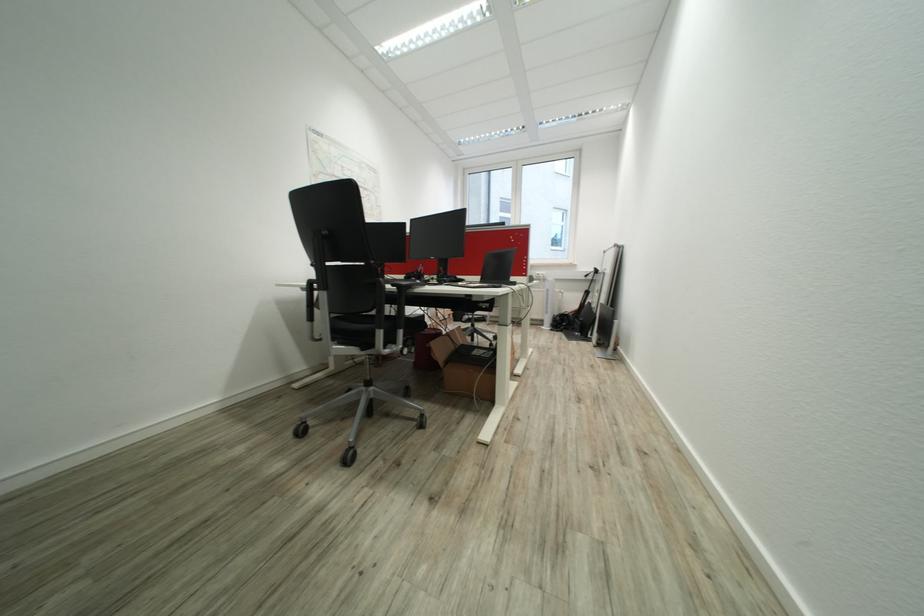
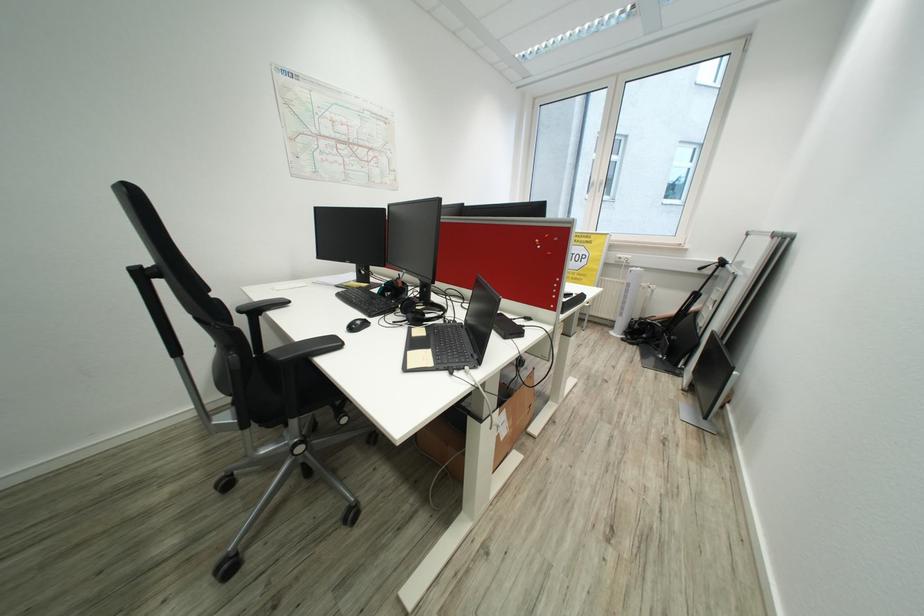
Which direction would the cameraman need to move to produce the second image?

The movement direction of the cameraman is right, forward.